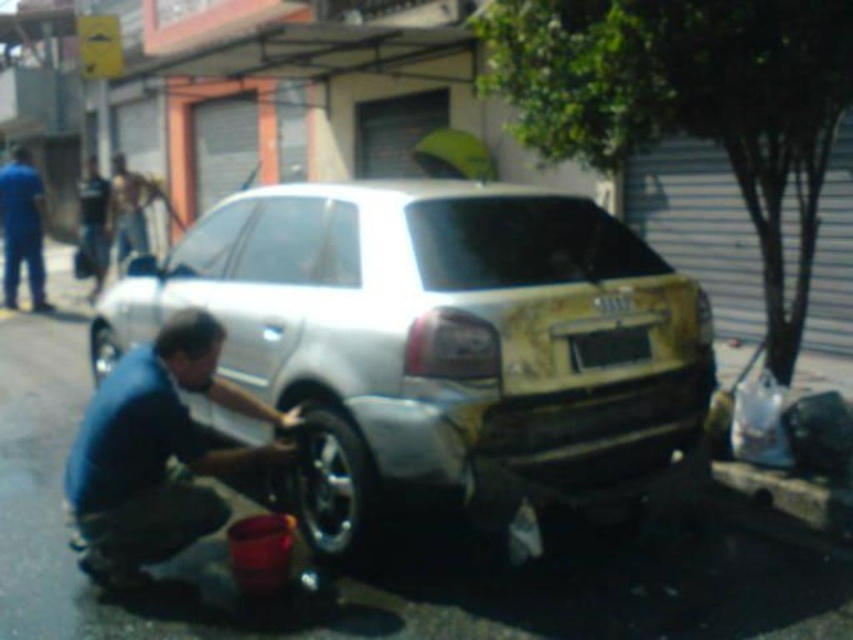
Question: Can you confirm if silver metallic car at center is positioned to the right of blue fabric shirt at lower left?

Choices:
 (A) yes
 (B) no

Answer: (A)

Question: From the image, what is the correct spatial relationship of blue fabric squat at lower left in relation to black rubber tire at lower center?

Choices:
 (A) right
 (B) left

Answer: (B)

Question: Among these points, which one is farthest from the camera?

Choices:
 (A) (82, 269)
 (B) (636, 348)
 (C) (94, 461)
 (D) (102, 340)

Answer: (A)

Question: Is black rubber tire at lower center positioned at the back of black rubber tire at lower left?

Choices:
 (A) no
 (B) yes

Answer: (A)

Question: Among these objects, which one is nearest to the camera?

Choices:
 (A) dark blue shirt at left
 (B) black rubber tire at lower left
 (C) blue fabric squat at lower left

Answer: (C)

Question: Among these objects, which one is farthest from the camera?

Choices:
 (A) blue uniform at left
 (B) black rubber tire at lower center

Answer: (A)